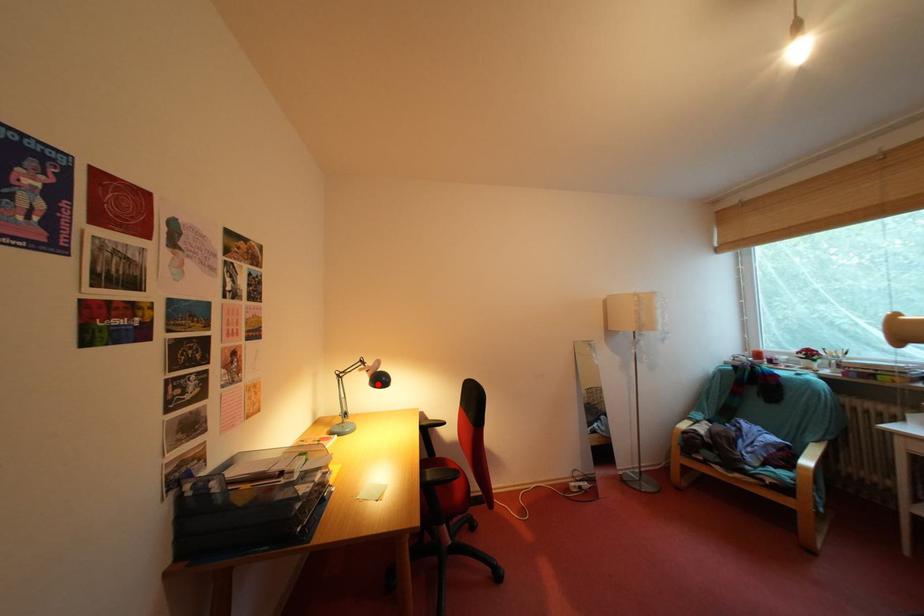
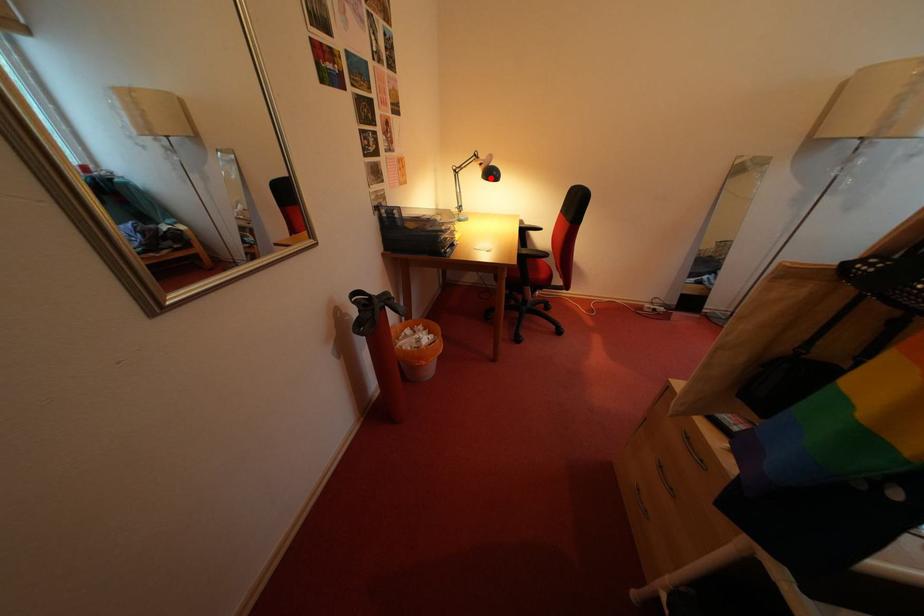
I am providing you with two images of the same scene from different viewpoints. A red point is marked on the first image and another point is marked on the second image. Is the red point in image1 aligned with the point shown in image2?

Yes